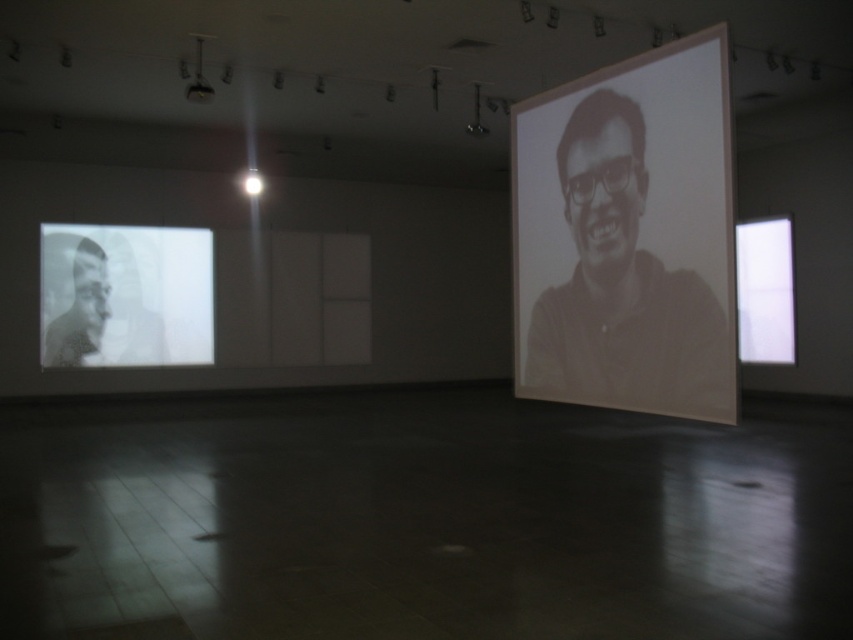
Question: Can you confirm if white matte projection screen at left is positioned to the right of black matte portrait at left?

Choices:
 (A) no
 (B) yes

Answer: (B)

Question: Which of these objects is positioned farthest from the black matte portrait at left?

Choices:
 (A) gray matte portrait at center
 (B) metallic projector at upper center
 (C) white matte projection screen at left
 (D) white glossy projection screen at right

Answer: (D)

Question: Can you confirm if gray matte portrait at center is positioned to the left of black matte portrait at left?

Choices:
 (A) no
 (B) yes

Answer: (A)

Question: Which of the following is the closest to the observer?

Choices:
 (A) (577, 321)
 (B) (56, 346)
 (C) (762, 305)
 (D) (62, 230)

Answer: (A)

Question: Which of the following is the farthest from the observer?

Choices:
 (A) white glossy projection screen at right
 (B) white matte projection screen at left
 (C) black matte portrait at left
 (D) gray matte portrait at center

Answer: (A)

Question: Is gray matte portrait at center to the right of black matte portrait at left from the viewer's perspective?

Choices:
 (A) yes
 (B) no

Answer: (A)